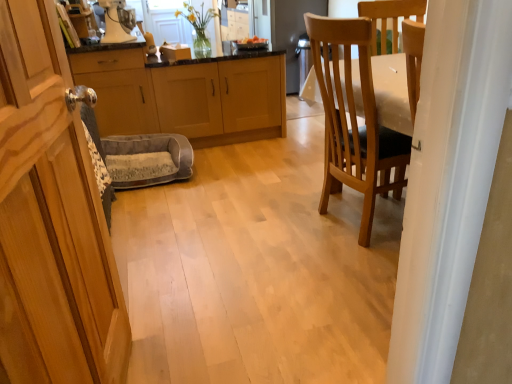
Question: Considering the relative sizes of wooden cabinet at left, positioned as the 1th cabinetry in front-to-back order, and white glossy blender at upper center in the image provided, is wooden cabinet at left, positioned as the 1th cabinetry in front-to-back order, shorter than white glossy blender at upper center?

Choices:
 (A) yes
 (B) no

Answer: (B)

Question: Does wooden cabinet at left, which ranks as the third cabinetry in back-to-front order, have a greater width compared to white glossy blender at upper center?

Choices:
 (A) no
 (B) yes

Answer: (A)

Question: Considering the relative sizes of wooden cabinet at left, which ranks as the third cabinetry in back-to-front order, and white glossy blender at upper center in the image provided, is wooden cabinet at left, which ranks as the third cabinetry in back-to-front order, thinner than white glossy blender at upper center?

Choices:
 (A) no
 (B) yes

Answer: (B)

Question: Can you confirm if wooden cabinet at left, which ranks as the third cabinetry in back-to-front order, is bigger than white glossy blender at upper center?

Choices:
 (A) no
 (B) yes

Answer: (B)

Question: Are wooden cabinet at left, which ranks as the third cabinetry in back-to-front order, and white glossy blender at upper center located far from each other?

Choices:
 (A) no
 (B) yes

Answer: (B)

Question: From the image's perspective, is wooden cabinet at left, positioned as the 1th cabinetry in front-to-back order, beneath white glossy blender at upper center?

Choices:
 (A) no
 (B) yes

Answer: (B)

Question: Can you confirm if white glossy blender at upper center is taller than light wood/finish cabinet at center, the 1th cabinetry when ordered from back to front?

Choices:
 (A) no
 (B) yes

Answer: (A)

Question: Is white glossy blender at upper center not within light wood/finish cabinet at center, acting as the 3th cabinetry starting from the front?

Choices:
 (A) yes
 (B) no

Answer: (A)

Question: From the image's perspective, does white glossy blender at upper center appear higher than light wood/finish cabinet at center, acting as the 3th cabinetry starting from the front?

Choices:
 (A) yes
 (B) no

Answer: (A)

Question: Does white glossy blender at upper center have a larger size compared to light wood/finish cabinet at center, acting as the 3th cabinetry starting from the front?

Choices:
 (A) no
 (B) yes

Answer: (A)

Question: Is white glossy blender at upper center in front of light wood/finish cabinet at center, the 1th cabinetry when ordered from back to front?

Choices:
 (A) yes
 (B) no

Answer: (A)

Question: From a real-world perspective, does white glossy blender at upper center stand above light wood/finish cabinet at center, acting as the 3th cabinetry starting from the front?

Choices:
 (A) yes
 (B) no

Answer: (A)

Question: Is wooden cabinet at left, which ranks as the third cabinetry in back-to-front order, not inside metallic silver cabinet at left, the second cabinetry viewed from the front?

Choices:
 (A) no
 (B) yes

Answer: (B)